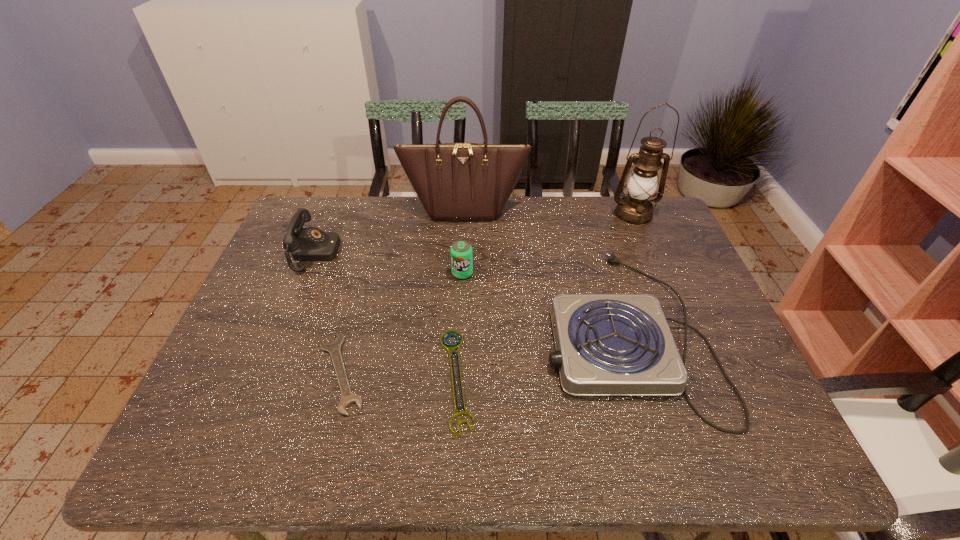
You are a GUI agent. You are given a task and a screenshot of the screen. Output one action in this format:
    pyautogui.click(x=<x>, y=<y>)
    Task: Click on the vacant space located on the front-facing side of the pop soda
    The width and height of the screenshot is (960, 540).
    Given the screenshot: What is the action you would take?
    pyautogui.click(x=460, y=340)

This screenshot has height=540, width=960. I want to click on vacant region located with a retractable cable on the side of the fifth tallest object, so click(441, 331).

The image size is (960, 540). In order to click on free spot located with a retractable cable on the side of the fifth tallest object in this screenshot , I will do `click(448, 331)`.

The image size is (960, 540). I want to click on free space located 0.290m with a retractable cable on the side of the fifth tallest object, so click(x=428, y=331).

Locate an element on the screen. This screenshot has height=540, width=960. free location located 0.390m on the right of the left wrench is located at coordinates (536, 372).

Locate an element on the screen. vacant space located 0.150m on the back of the right wrench is located at coordinates (461, 291).

Where is `handbag that is at the far edge`? This screenshot has width=960, height=540. handbag that is at the far edge is located at coordinates (454, 181).

Where is `oil lamp that is at the far edge`? oil lamp that is at the far edge is located at coordinates (635, 209).

This screenshot has width=960, height=540. What are the coordinates of `telephone positioned at the far edge` in the screenshot? It's located at (309, 244).

Find the location of a particular element. hotplate present at the near edge is located at coordinates (606, 344).